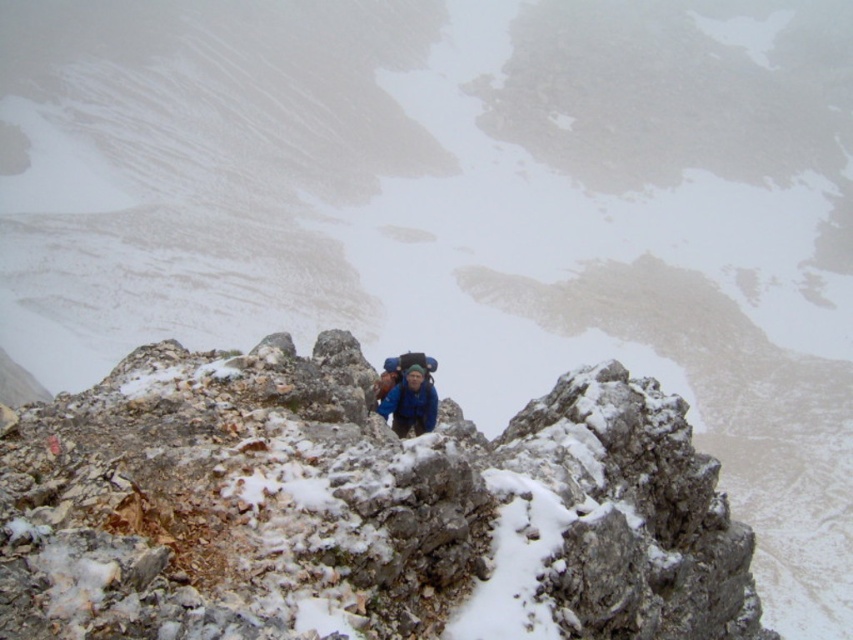
Which is more to the right, gray rough rock at center or blue fabric jacket at center?

gray rough rock at center is more to the right.

Is gray rough rock at center further to camera compared to blue fabric jacket at center?

No, gray rough rock at center is in front of blue fabric jacket at center.

Is point (190, 540) closer to viewer compared to point (404, 372)?

Yes, it is in front of point (404, 372).

Find the location of a particular element. gray rough rock at center is located at coordinates (358, 509).